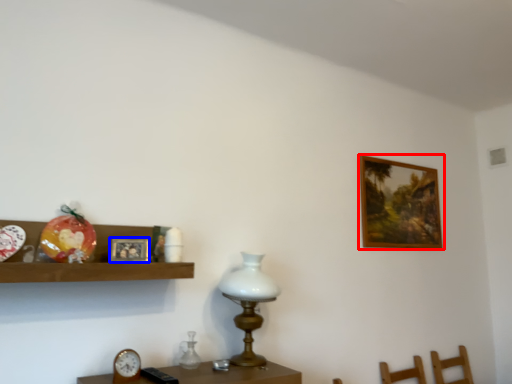
Question: Which of the following is the closest to the observer, picture frame (highlighted by a red box) or picture frame (highlighted by a blue box)?

Choices:
 (A) picture frame
 (B) picture frame

Answer: (B)